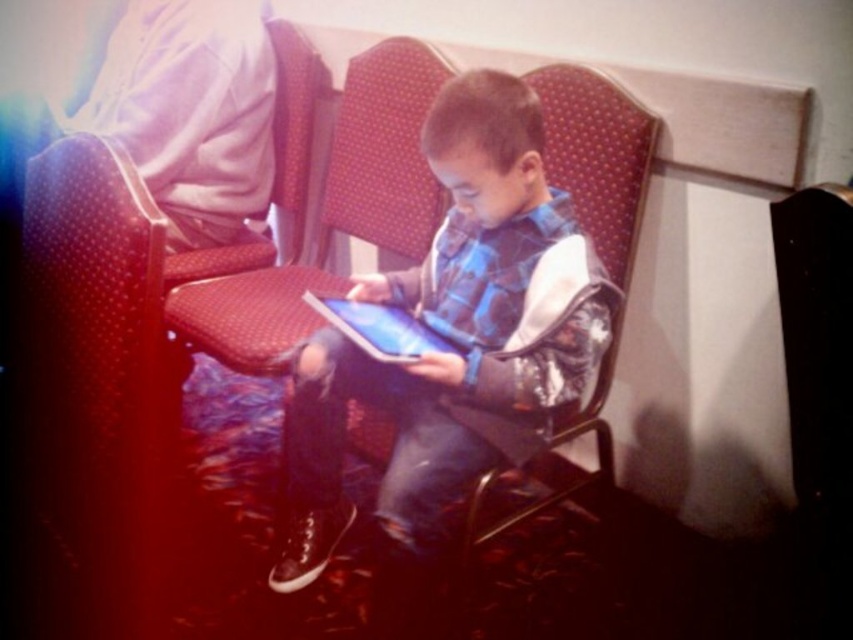
Question: Which of the following is the closest to the observer?

Choices:
 (A) matte blue hoodie at center
 (B) matte red chair at center
 (C) matte black tablet at center

Answer: (A)

Question: Which point is closer to the camera taking this photo?

Choices:
 (A) (300, 490)
 (B) (331, 310)

Answer: (B)

Question: Can you confirm if matte blue hoodie at center is positioned above matte black tablet at center?

Choices:
 (A) no
 (B) yes

Answer: (A)

Question: Is matte blue hoodie at center to the left of matte red chair at center from the viewer's perspective?

Choices:
 (A) no
 (B) yes

Answer: (A)

Question: Is matte black tablet at center above matte red chair at center?

Choices:
 (A) no
 (B) yes

Answer: (A)

Question: Based on their relative distances, which object is farther from the matte black tablet at center?

Choices:
 (A) matte red chair at center
 (B) matte blue hoodie at center

Answer: (A)